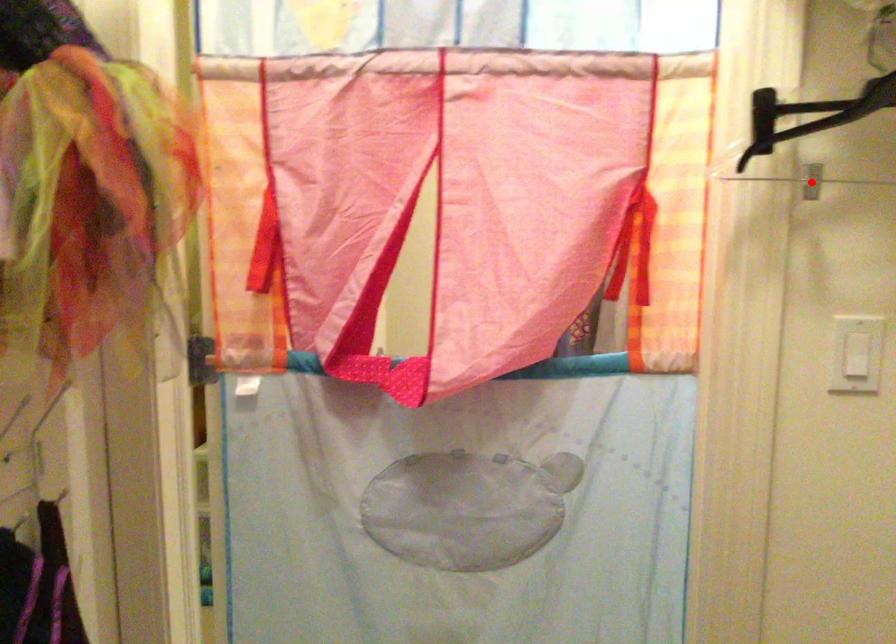
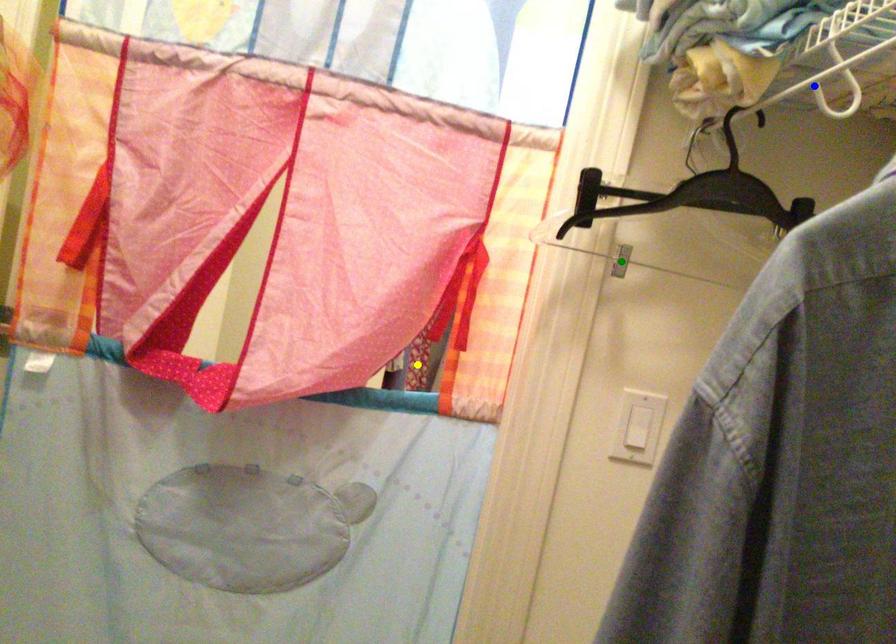
Question: I am providing you with two images of the same scene from different viewpoints. A red point is marked on the first image. You are given multiple points on the second image. Which point in image 2 represents the same 3d spot as the red point in image 1?

Choices:
 (A) yellow point
 (B) blue point
 (C) green point

Answer: (C)